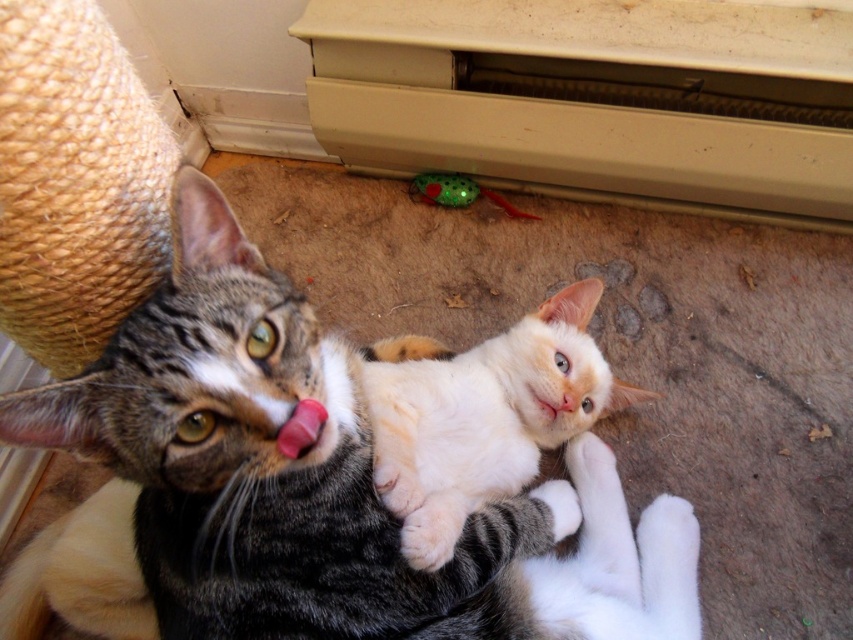
Question: Estimate the real-world distances between objects in this image. Which object is farther from the white matte mouth at center?

Choices:
 (A) white fluffy cat at center
 (B) green glossy toy mouse at center
 (C) white fur at lower center

Answer: (B)

Question: Considering the relative positions of tabby fur cat at center and pink glossy tongue at center in the image provided, where is tabby fur cat at center located with respect to pink glossy tongue at center?

Choices:
 (A) below
 (B) above

Answer: (A)

Question: Does green glossy toy mouse at center have a smaller size compared to pink glossy tongue at center?

Choices:
 (A) yes
 (B) no

Answer: (B)

Question: Based on their relative distances, which object is farther from the white fur at lower center?

Choices:
 (A) pink glossy tongue at center
 (B) tabby fur cat at center
 (C) white fluffy cat at center
 (D) green glossy toy mouse at center

Answer: (D)

Question: Which point is farther to the camera?

Choices:
 (A) green glossy toy mouse at center
 (B) white matte mouth at center
 (C) white fur at lower center

Answer: (A)

Question: Can you confirm if tabby fur cat at center is positioned to the left of white fur at lower center?

Choices:
 (A) no
 (B) yes

Answer: (B)